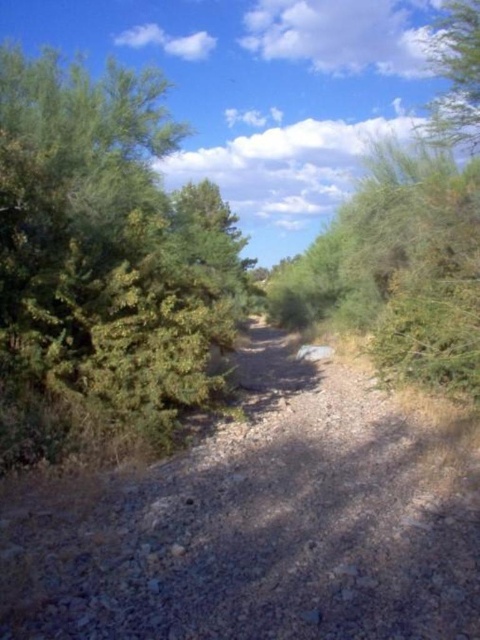
Does green leafy bush at left have a greater height compared to green leafy bush at upper right?

No.

Is green leafy bush at left positioned at the back of green leafy bush at upper right?

No.

You are a GUI agent. You are given a task and a screenshot of the screen. Output one action in this format:
    pyautogui.click(x=<x>, y=<y>)
    Task: Click on the green leafy bush at left
    
    Given the screenshot: What is the action you would take?
    click(x=106, y=268)

Is dusty gravel path at center to the left of green leafy bush at upper right from the viewer's perspective?

Yes, dusty gravel path at center is to the left of green leafy bush at upper right.

Is dusty gravel path at center wider than green leafy bush at upper right?

Incorrect, dusty gravel path at center's width does not surpass green leafy bush at upper right's.

Is point (204, 484) positioned after point (430, 44)?

That is False.

The height and width of the screenshot is (640, 480). In order to click on dusty gravel path at center in this screenshot , I will do `click(261, 525)`.

How much distance is there between dusty gravel path at center and green leafy bush at left?

dusty gravel path at center and green leafy bush at left are 8.86 meters apart.

Is dusty gravel path at center bigger than green leafy bush at left?

Incorrect, dusty gravel path at center is not larger than green leafy bush at left.

Is point (181, 544) closer to viewer compared to point (103, 157)?

Yes, it is in front of point (103, 157).

You are a GUI agent. You are given a task and a screenshot of the screen. Output one action in this format:
    pyautogui.click(x=<x>, y=<y>)
    Task: Click on the dusty gravel path at center
    This screenshot has height=640, width=480.
    Given the screenshot: What is the action you would take?
    pyautogui.click(x=261, y=525)